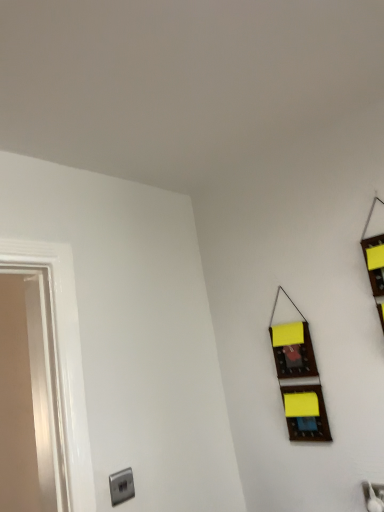
Question: Relative to satin silver outlet at lower left, is wooden organizer at right in front or behind?

Choices:
 (A) front
 (B) behind

Answer: (B)

Question: From a real-world perspective, is wooden organizer at right positioned above or below satin silver outlet at lower left?

Choices:
 (A) below
 (B) above

Answer: (B)

Question: Considering the positions of point (317, 419) and point (115, 475), is point (317, 419) closer or farther from the camera than point (115, 475)?

Choices:
 (A) closer
 (B) farther

Answer: (B)

Question: Considering the positions of satin silver outlet at lower left and wooden organizer at right in the image, is satin silver outlet at lower left bigger or smaller than wooden organizer at right?

Choices:
 (A) small
 (B) big

Answer: (A)

Question: Considering the relative positions of satin silver outlet at lower left and wooden organizer at right in the image provided, is satin silver outlet at lower left to the left or to the right of wooden organizer at right?

Choices:
 (A) left
 (B) right

Answer: (A)

Question: In the image, is satin silver outlet at lower left positioned in front of or behind wooden organizer at right?

Choices:
 (A) behind
 (B) front

Answer: (B)

Question: Does point (120, 492) appear closer or farther from the camera than point (309, 352)?

Choices:
 (A) closer
 (B) farther

Answer: (A)